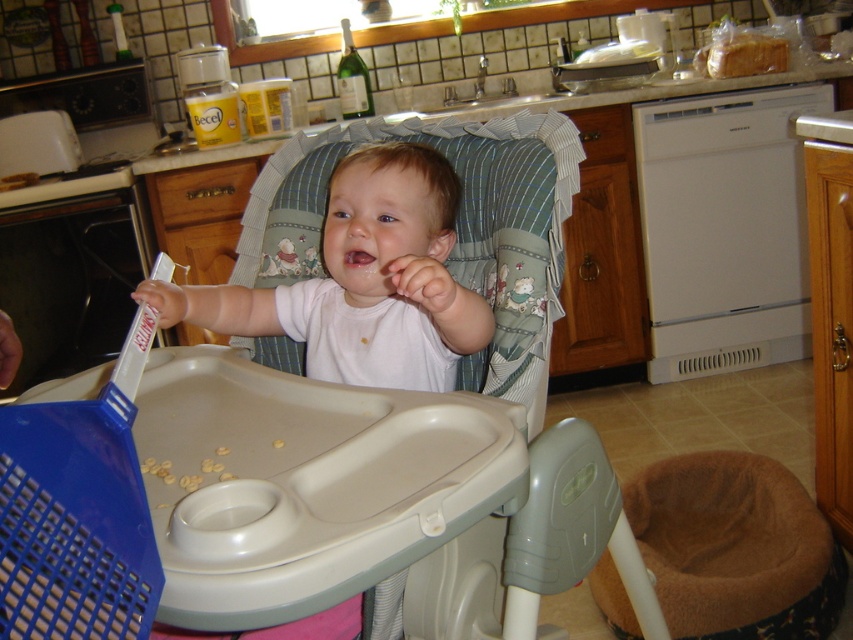
Question: Which object appears closest to the camera in this image?

Choices:
 (A) white matte baby at center
 (B) pink glossy lips at center

Answer: (A)

Question: Estimate the real-world distances between objects in this image. Which object is closer to the brown plush pet bed at lower right?

Choices:
 (A) white matte baby at center
 (B) pink glossy lips at center

Answer: (A)

Question: Does brown plush pet bed at lower right lie behind white matte baby at center?

Choices:
 (A) yes
 (B) no

Answer: (A)

Question: Does brown plush pet bed at lower right have a lesser width compared to white matte baby at center?

Choices:
 (A) no
 (B) yes

Answer: (A)

Question: Is brown plush pet bed at lower right positioned behind pink glossy lips at center?

Choices:
 (A) no
 (B) yes

Answer: (B)

Question: Which object is positioned farthest from the brown plush pet bed at lower right?

Choices:
 (A) pink glossy lips at center
 (B) white matte baby at center

Answer: (A)